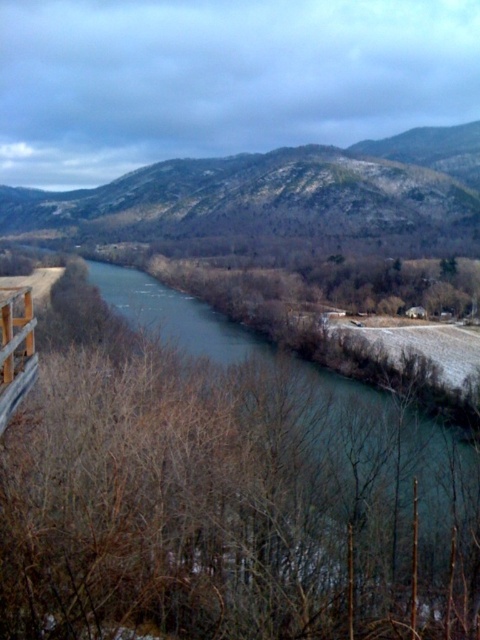
Does gray rocky mountain at center have a greater height compared to greenish-blue water at center?

Yes.

Locate an element on the screen. This screenshot has height=640, width=480. gray rocky mountain at center is located at coordinates (276, 193).

Measure the distance between point (196, 184) and camera.

They are 242.68 meters apart.

This screenshot has height=640, width=480. In order to click on gray rocky mountain at center in this screenshot , I will do `click(276, 193)`.